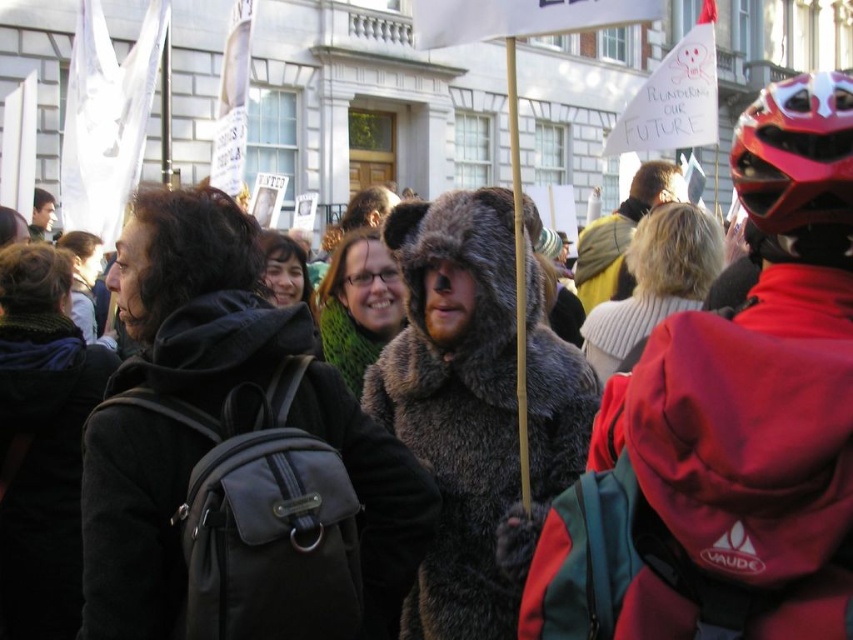
Question: Which point is farther to the camera?

Choices:
 (A) shiny red helmet at upper right
 (B) knitted white sweater at center
 (C) dark gray hoodie at center

Answer: (B)

Question: Among these points, which one is farthest from the camera?

Choices:
 (A) (842, 220)
 (B) (714, 244)
 (C) (305, 440)
 (D) (344, 269)

Answer: (B)

Question: Does shiny red helmet at upper right have a larger size compared to green fuzzy scarf at center?

Choices:
 (A) no
 (B) yes

Answer: (B)

Question: Among these objects, which one is farthest from the camera?

Choices:
 (A) knitted white sweater at center
 (B) dark gray hoodie at center

Answer: (A)

Question: In this image, where is shiny red helmet at upper right located relative to green fuzzy scarf at center?

Choices:
 (A) right
 (B) left

Answer: (A)

Question: Can you confirm if knitted white sweater at center is positioned to the left of green fuzzy scarf at center?

Choices:
 (A) yes
 (B) no

Answer: (B)